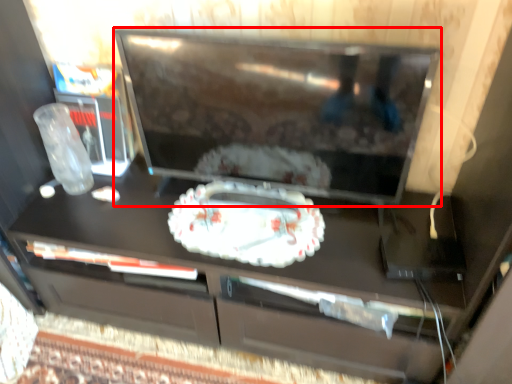
Question: From the image's perspective, what is the correct spatial relationship of television (annotated by the red box) in relation to cake?

Choices:
 (A) above
 (B) below

Answer: (A)